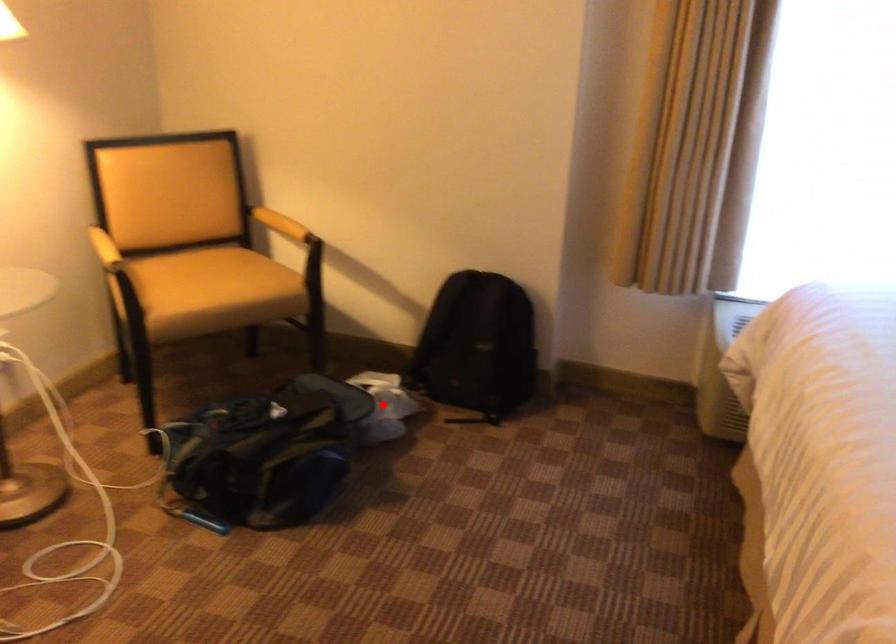
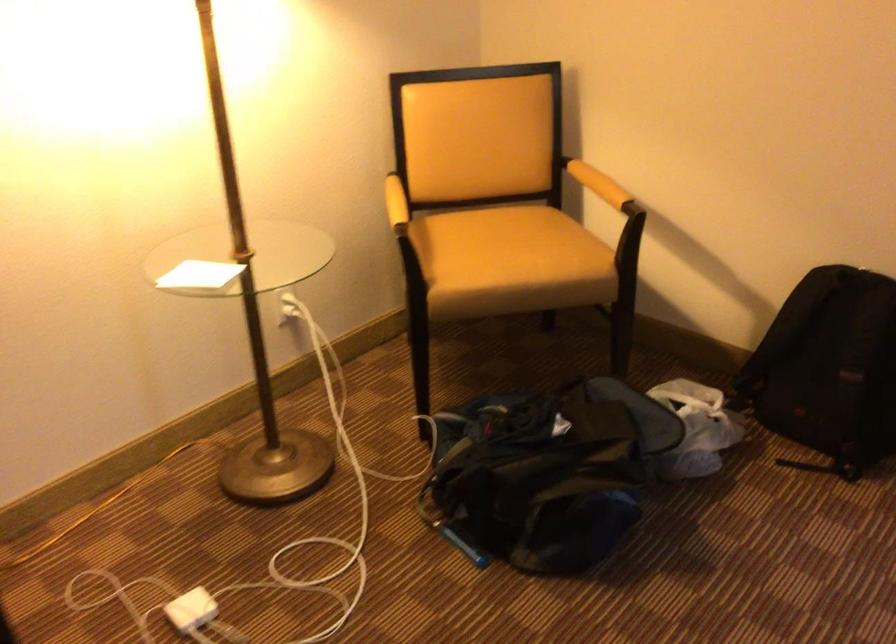
The point at the highlighted location is marked in the first image. Where is the corresponding point in the second image?

(696, 428)